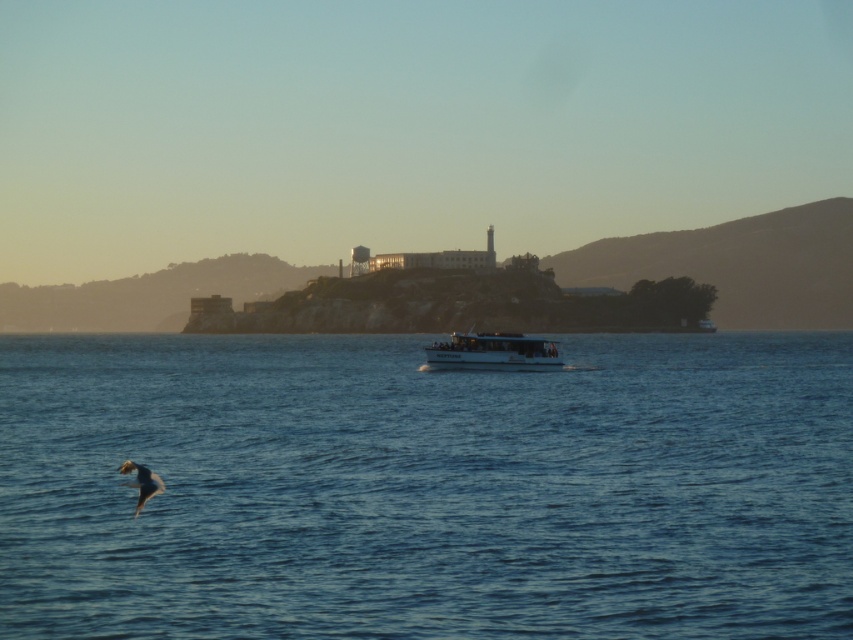
In the scene shown: Is blue water at center taller than white matte boat at center?

Correct, blue water at center is much taller as white matte boat at center.

Can you confirm if blue water at center is positioned below white matte boat at center?

Correct, blue water at center is located below white matte boat at center.

Which is behind, point (646, 576) or point (462, 340)?

The point (462, 340) is behind.

Image resolution: width=853 pixels, height=640 pixels. I want to click on blue water at center, so click(426, 488).